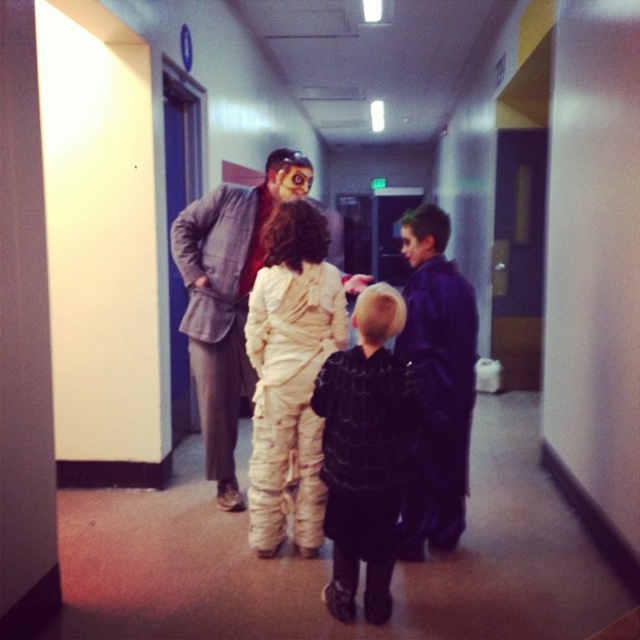
You are a photographer setting up for a school event. You need to arrange two costumes in the hallway so that they are visible in the photo. The costumes are the black textured coat at center and the matte gray suit at center. Given their sizes, which costume should you place closer to the camera to ensure both are fully visible in the frame?

The black textured coat at center is smaller than the matte gray suit at center. To ensure both are fully visible, place the smaller black textured coat at center closer to the camera so it appears larger in the photo, while the matte gray suit at center can be positioned slightly farther back.